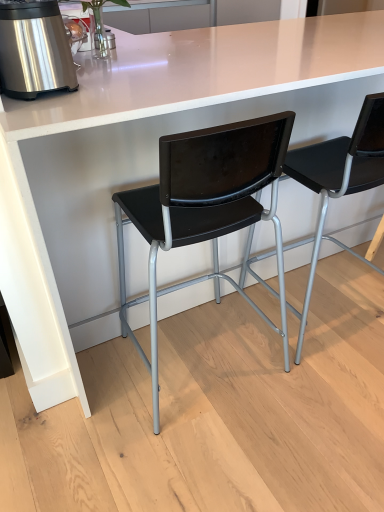
Find the location of a particular element. vacant space to the left of black plastic chair at center, which is the first chair from left to right is located at coordinates 69,401.